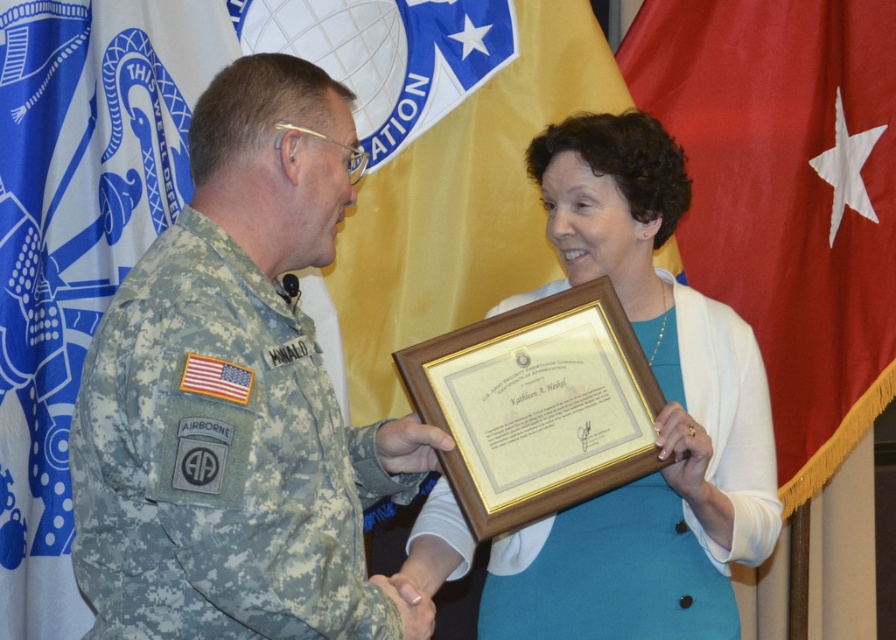
You are attending a formal event and notice a flag displayed at point (76, 241). What color is the flag located at that coordinate?

The flag at point (76, 241) is blue.

You are a photographer standing at the camera position. You want to adjust your focus to capture a sharp image of the point at coordinates point [190,625]. What is the minimum distance you need to adjust your focus to ensure the point is in focus?

The minimum distance adjustment needed is 1.92 meters because the point [190,625] is located exactly 1.92 meters away from the camera.

You are organizing a military award ceremony and need to place the red fabric flag at right and the wooden framed certificate at center on a display table. Which object should be placed first if you want to ensure the larger item is positioned in the center of the table?

The wooden framed certificate at center should be placed first because it is larger than the red fabric flag at right, ensuring it can be centered properly before arranging the smaller flag around it.